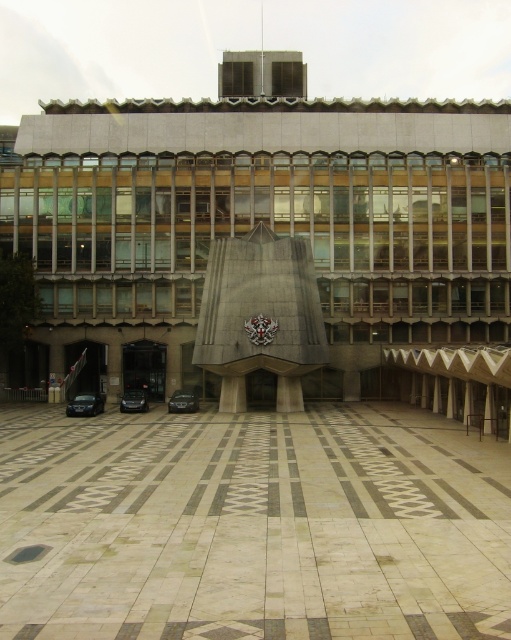
You are standing at the entrance of the building and want to walk towards the beige stone plaza at center. Which direction should you head?

The beige stone plaza at center is located at point (x=251, y=525), so you should head towards the center of the image to reach it.

You are standing in front of the modern building with the angular sculpture. There are two points marked on the ground. The first point is at coordinates point (275,307) and the second is at point (177,401). Which point is closer to the sculpture?

Point (275,307) is in front of point (177,401), so it is closer to the sculpture.

You are a photographer setting up a shot of the gray concrete sculpture at center and the shiny silver car at center. Which object should you focus on first if you want to capture both in the same frame without moving the camera?

You should focus on the gray concrete sculpture at center first because it might be wider than the shiny silver car at center, so ensuring it is centered and in focus will help capture both effectively.